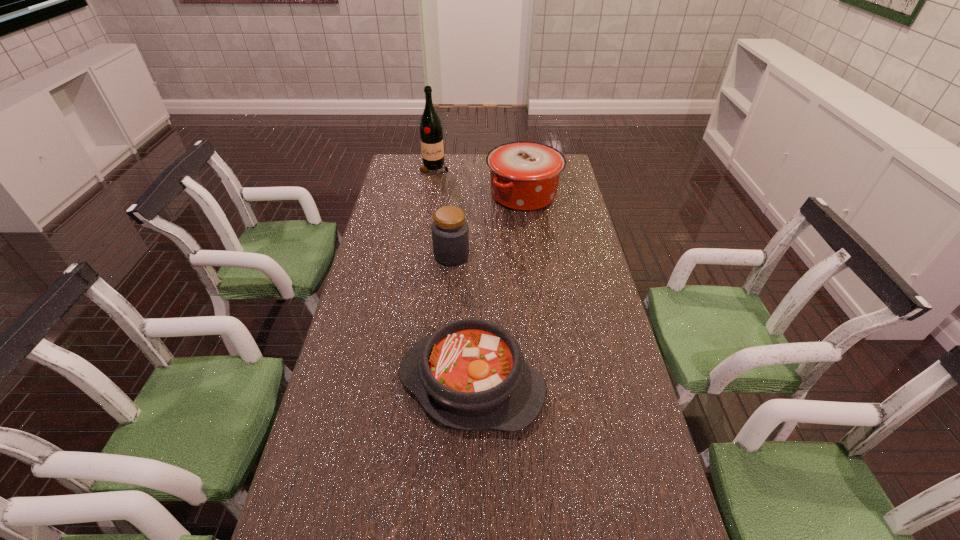
Image resolution: width=960 pixels, height=540 pixels. Identify the location of empty location between the nearer casserole and the wine bottle. (453, 276).

Locate an element on the screen. This screenshot has height=540, width=960. empty location between the taller casserole and the shortest object is located at coordinates (497, 289).

This screenshot has height=540, width=960. Find the location of `empty location between the nearer casserole and the farther casserole`. empty location between the nearer casserole and the farther casserole is located at coordinates (497, 289).

Identify which object is the second nearest to the jar. Please provide its 2D coordinates. Your answer should be formatted as a tuple, i.e. [(x, y)], where the tuple contains the x and y coordinates of a point satisfying the conditions above.

[(470, 374)]

Locate an element on the screen. the third closest object relative to the shortest object is located at coordinates (431, 134).

The image size is (960, 540). Find the location of `vacant space that satisfies the following two spatial constraints: 1. on the back side of the shortest object; 2. on the surface of the third farthest object near the warning symbol`. vacant space that satisfies the following two spatial constraints: 1. on the back side of the shortest object; 2. on the surface of the third farthest object near the warning symbol is located at coordinates (473, 255).

Where is `vacant position in the image that satisfies the following two spatial constraints: 1. on the front side of the farther casserole; 2. on the surface of the jar near the warning symbol`? Image resolution: width=960 pixels, height=540 pixels. vacant position in the image that satisfies the following two spatial constraints: 1. on the front side of the farther casserole; 2. on the surface of the jar near the warning symbol is located at coordinates (532, 255).